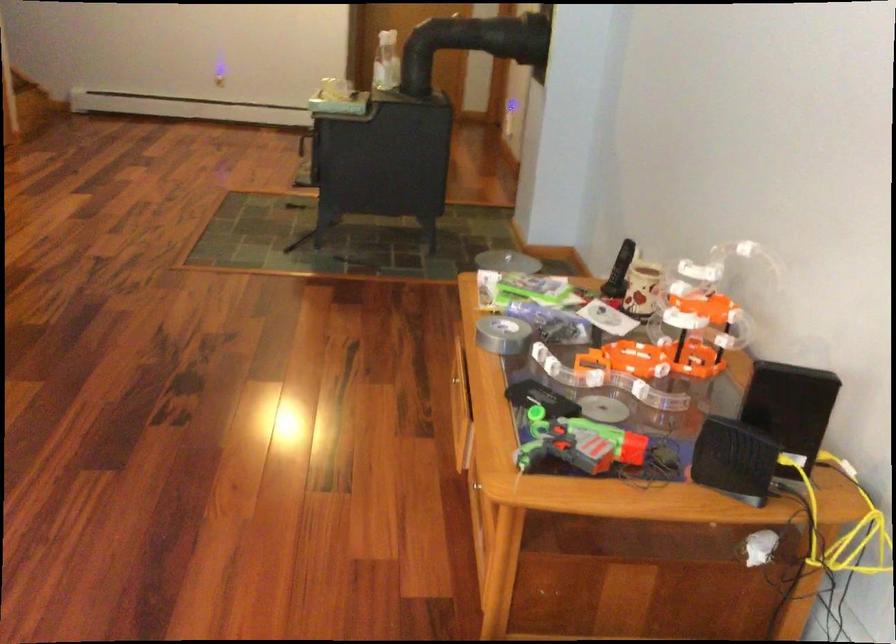
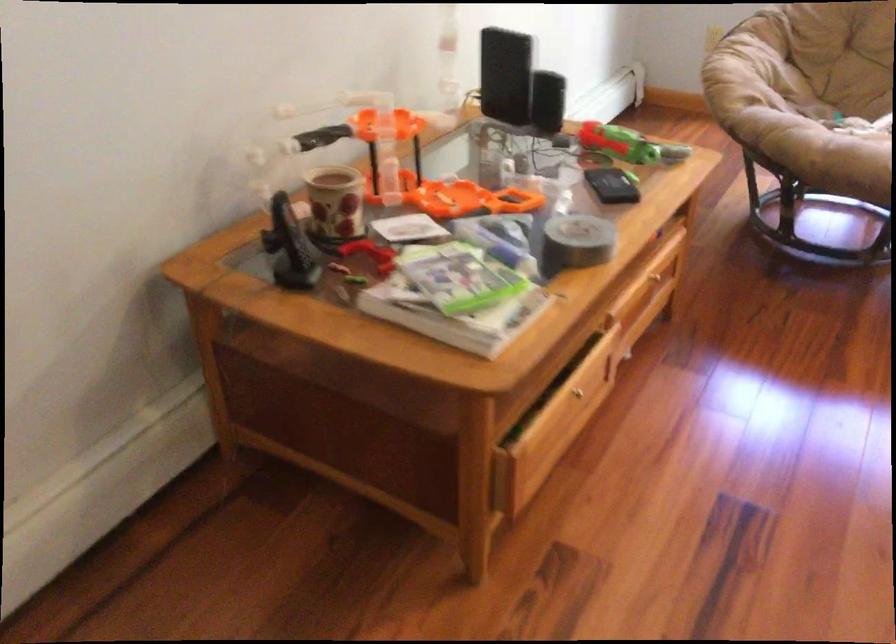
Locate, in the second image, the point that corresponds to (570,421) in the first image.

(627, 145)